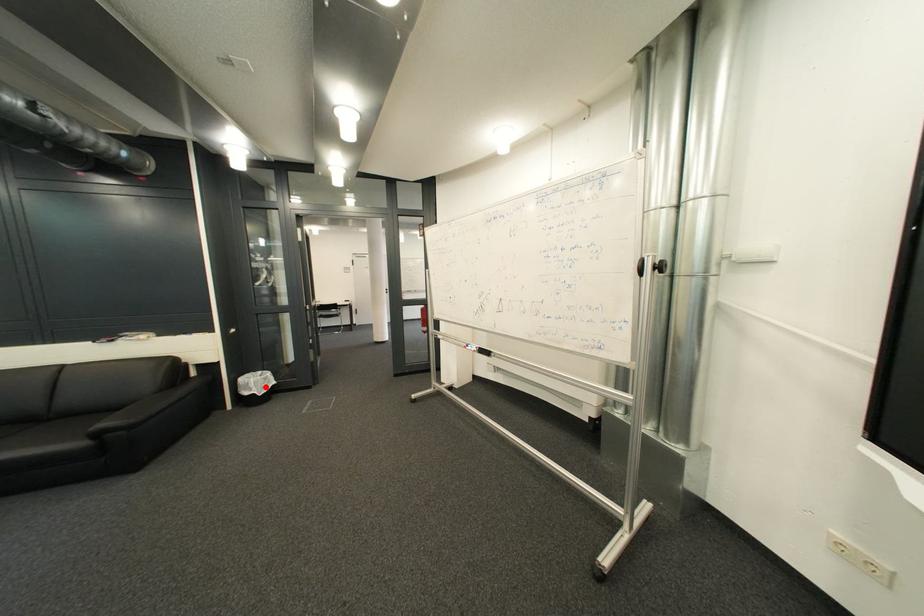
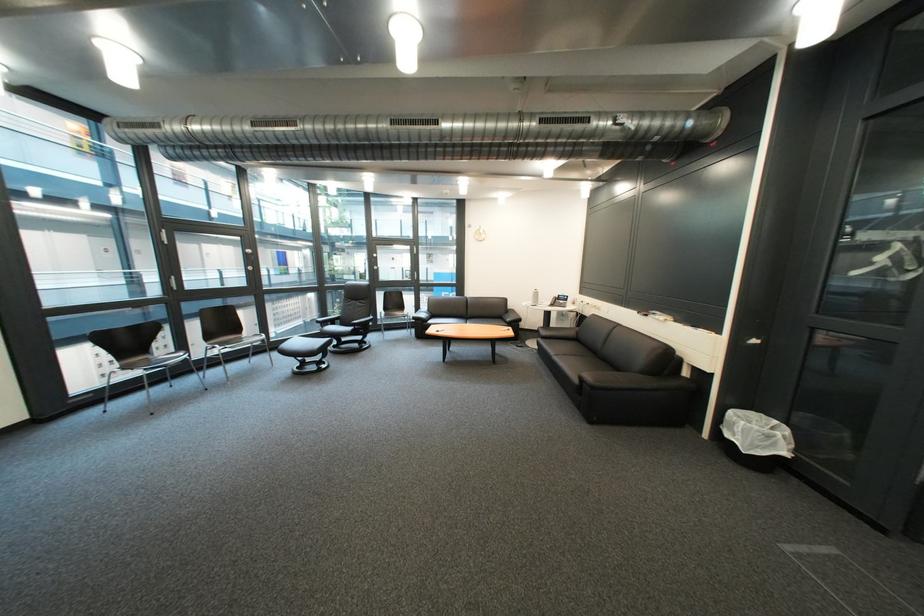
Find the pixel in the second image that matches the highlighted location in the first image.

(751, 431)